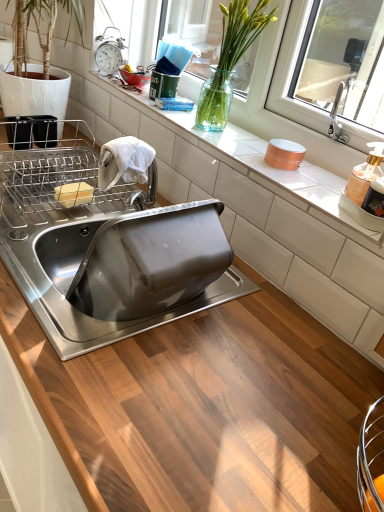
Where is `unoccupied region to the right of yellow butter at upper left`? The width and height of the screenshot is (384, 512). unoccupied region to the right of yellow butter at upper left is located at coordinates (106, 208).